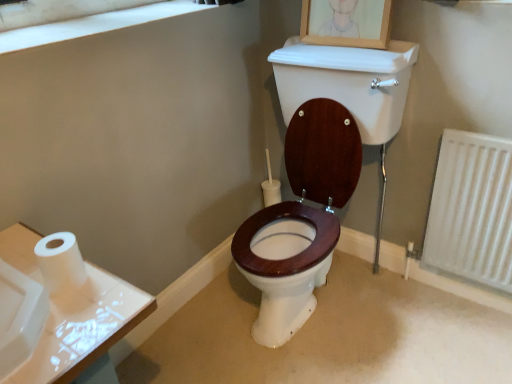
Question: Looking at their shapes, would you say white matte toilet paper at left is wider or thinner than wooden picture frame at upper center?

Choices:
 (A) thin
 (B) wide

Answer: (A)

Question: In the image, is white matte toilet paper at left positioned in front of or behind wooden picture frame at upper center?

Choices:
 (A) front
 (B) behind

Answer: (A)

Question: Which is nearer to the white matte window frame at upper left?

Choices:
 (A) wooden picture frame at upper center
 (B) white matte toilet paper at left
 (C) white textured radiator at lower right

Answer: (A)

Question: Considering the real-world distances, which object is farthest from the white matte toilet paper at left?

Choices:
 (A) white textured radiator at lower right
 (B) wooden picture frame at upper center
 (C) white matte window frame at upper left

Answer: (A)